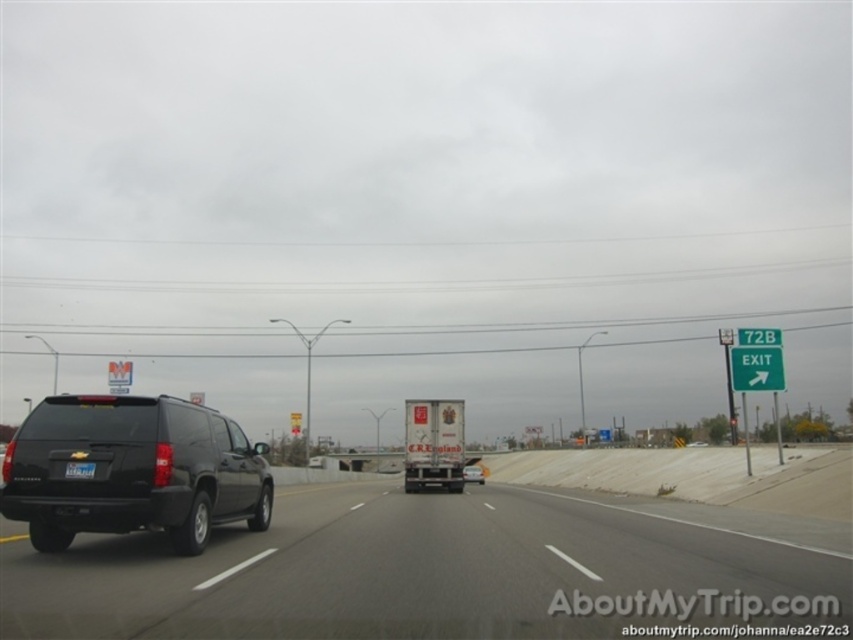
You are a driver approaching the highway and see the black rubber suv at left and the black matte suv at center. Which SUV is taller?

The black rubber suv at left is taller than the black matte suv at center.

You are a driver approaching the highway exit. You see two points marked on the road ahead. The first point is at coordinate point (780, 355) and the second is at point (82, 477). Which point is closer to your current position?

Point (82, 477) is closer to your current position because it is closer to the camera than point (780, 355).